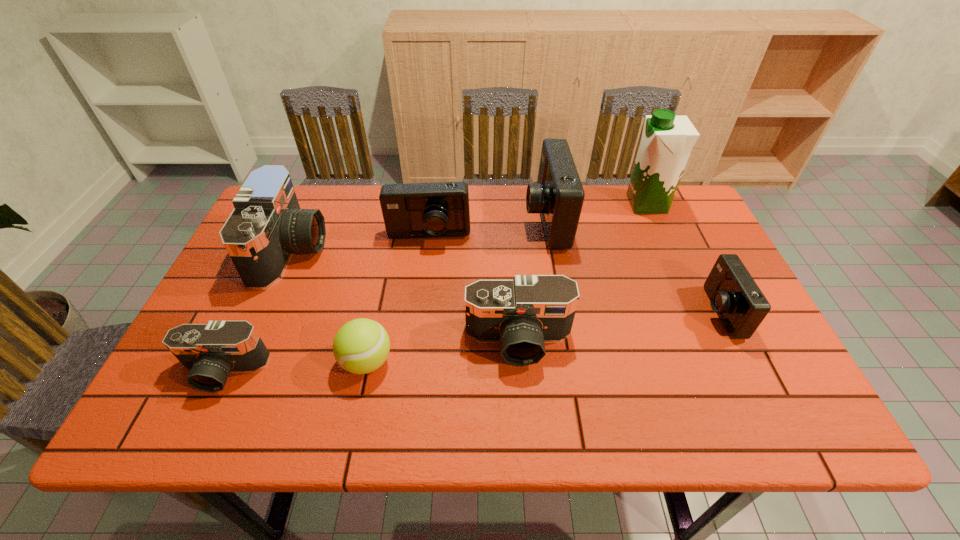
This screenshot has width=960, height=540. Find the location of `the tallest object`. the tallest object is located at coordinates (667, 140).

Locate an element on the screen. green soya milk is located at coordinates (667, 140).

You are a GUI agent. You are given a task and a screenshot of the screen. Output one action in this format:
    pyautogui.click(x=<x>, y=<y>)
    Task: Click on the biggest blue camera
    Image resolution: width=960 pixels, height=540 pixels.
    Given the screenshot: What is the action you would take?
    tap(558, 196)

Image resolution: width=960 pixels, height=540 pixels. Find the location of `the biggest black camera`. the biggest black camera is located at coordinates (267, 225).

The width and height of the screenshot is (960, 540). In order to click on the leftmost blue camera in this screenshot , I will do `click(440, 209)`.

Locate an element on the screen. the rightmost black camera is located at coordinates (522, 314).

Identify the location of the rightmost camera. Image resolution: width=960 pixels, height=540 pixels. (734, 295).

Locate an element on the screen. The width and height of the screenshot is (960, 540). the nearest blue camera is located at coordinates (734, 295).

Where is `tennis ball`? The image size is (960, 540). tennis ball is located at coordinates 362,345.

The height and width of the screenshot is (540, 960). In order to click on the smallest black camera in this screenshot , I will do `click(211, 351)`.